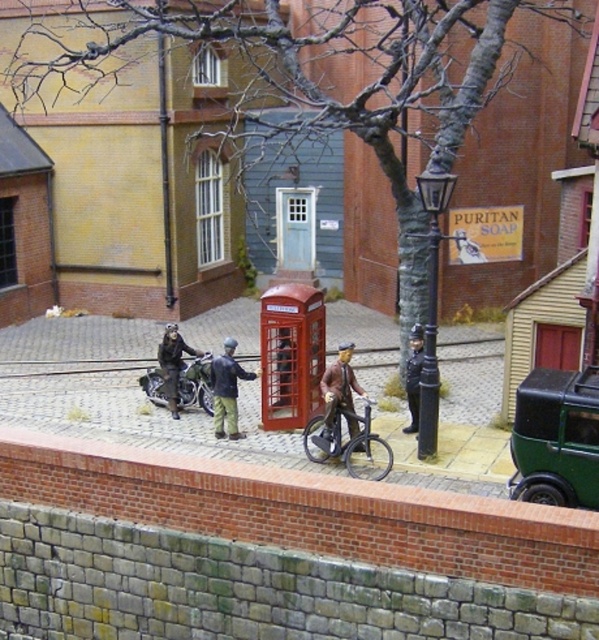
This screenshot has width=599, height=640. I want to click on shiny metallic bicycle at center, so click(x=195, y=385).

Can you confirm if shiny metallic bicycle at center is taller than brown leather jacket at center?

In fact, shiny metallic bicycle at center may be shorter than brown leather jacket at center.

Identify the location of shiny metallic bicycle at center. tap(195, 385).

Is point (181, 397) positioned behind point (412, 385)?

Yes, point (181, 397) is farther from viewer.

What do you see at coordinates (195, 385) in the screenshot?
I see `shiny metallic bicycle at center` at bounding box center [195, 385].

Identify the location of shiny metallic bicycle at center. Image resolution: width=599 pixels, height=640 pixels. (195, 385).

Who is positioned more to the left, green matte car at lower right or dark brown leather jacket at center?

dark brown leather jacket at center

Does point (522, 384) come closer to viewer compared to point (420, 365)?

That is True.

This screenshot has width=599, height=640. Identify the location of green matte car at lower right. (556, 438).